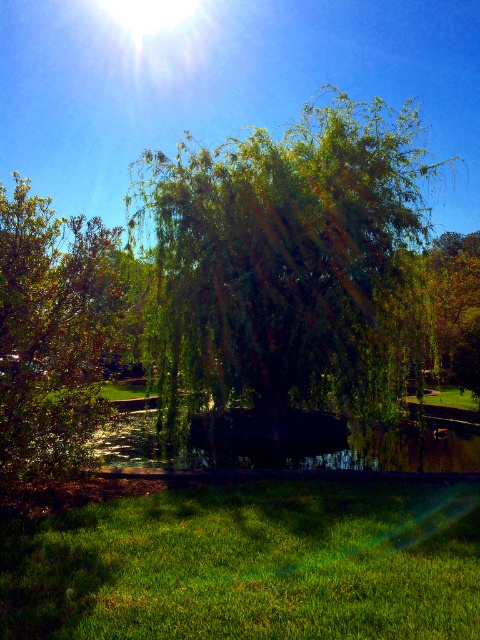
You are standing in the serene outdoor scene with the large weeping willow tree. You see two points marked in the image. Which point is closer to you, point (x=152, y=296) or point (x=469, y=314)?

Point (x=152, y=296) is closer to the camera than point (x=469, y=314).

You are an artist planning to paint the scene. You want to emphasize the size difference between the green leafy willow at center and the green leafy tree at left. Which tree should you paint larger in your artwork?

You should paint the green leafy willow at center larger than the green leafy tree at left because the green leafy willow at center is bigger than the green leafy tree at left.

You are an environmental scientist assessing the health of the trees in this area. You notice two trees at the center of the image, the green leafy willow at center and the green leafy tree at center. Which one do you think has a larger canopy spread?

The green leafy willow at center has a larger canopy spread than the green leafy tree at center because the description states it is bigger.